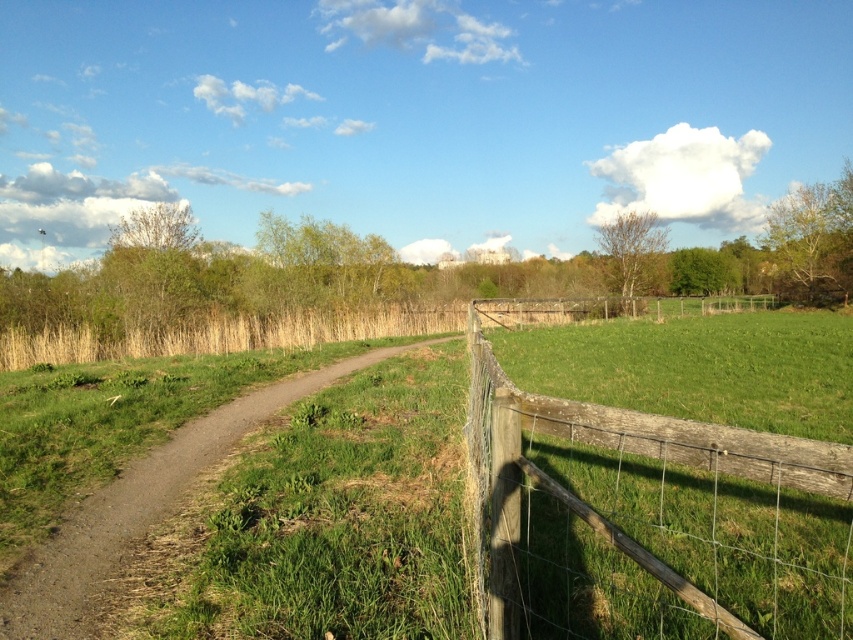
Question: Which of the following is the closest to the observer?

Choices:
 (A) wooden wire fence at right
 (B) dirt path at center

Answer: (A)

Question: Does wooden wire fence at right lie in front of dirt path at center?

Choices:
 (A) yes
 (B) no

Answer: (A)

Question: Considering the relative positions of wooden wire fence at right and dirt path at center in the image provided, where is wooden wire fence at right located with respect to dirt path at center?

Choices:
 (A) left
 (B) right

Answer: (B)

Question: Is wooden wire fence at right closer to camera compared to dirt path at center?

Choices:
 (A) no
 (B) yes

Answer: (B)